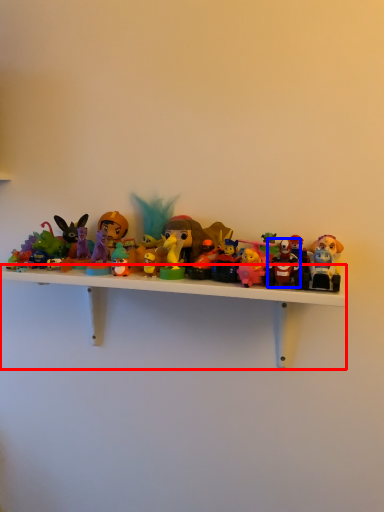
Question: Among these objects, which one is nearest to the camera, shelf (highlighted by a red box) or toy (highlighted by a blue box)?

Choices:
 (A) shelf
 (B) toy

Answer: (A)